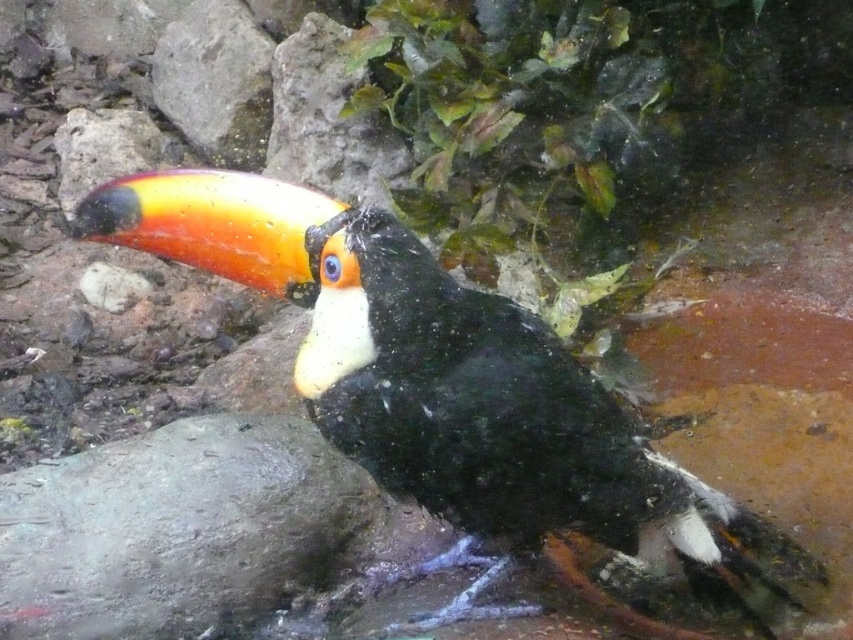
Question: Observing the image, what is the correct spatial positioning of shiny black toucan at center in reference to gray rough stone at lower left?

Choices:
 (A) above
 (B) below

Answer: (A)

Question: Can you confirm if shiny black toucan at center is bigger than gray rough stone at lower left?

Choices:
 (A) yes
 (B) no

Answer: (A)

Question: Considering the relative positions of shiny black toucan at center and gray rough stone at lower left in the image provided, where is shiny black toucan at center located with respect to gray rough stone at lower left?

Choices:
 (A) right
 (B) left

Answer: (A)

Question: Which object is closer to the camera taking this photo?

Choices:
 (A) gray rough stone at lower left
 (B) shiny black toucan at center

Answer: (B)